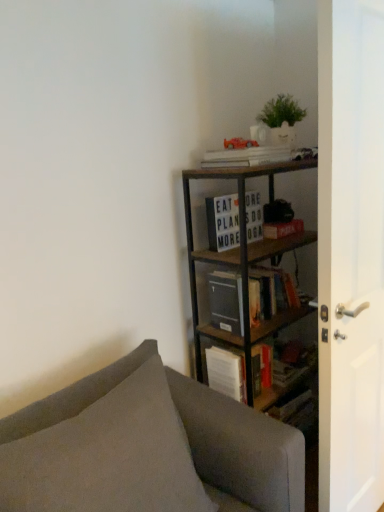
Question: Should I look upward or downward to see metallic brown bookcase at upper right?

Choices:
 (A) up
 (B) down

Answer: (B)

Question: Could you tell me if white glossy door at right is turned towards metallic brown bookcase at upper right?

Choices:
 (A) no
 (B) yes

Answer: (B)

Question: Are white glossy door at right and metallic brown bookcase at upper right far apart?

Choices:
 (A) no
 (B) yes

Answer: (A)

Question: From a real-world perspective, is white glossy door at right on top of metallic brown bookcase at upper right?

Choices:
 (A) yes
 (B) no

Answer: (A)

Question: From the image's perspective, is white glossy door at right below metallic brown bookcase at upper right?

Choices:
 (A) no
 (B) yes

Answer: (A)

Question: Can you confirm if white glossy door at right is positioned to the right of metallic brown bookcase at upper right?

Choices:
 (A) no
 (B) yes

Answer: (B)

Question: Considering the relative sizes of white glossy door at right and metallic brown bookcase at upper right in the image provided, is white glossy door at right wider than metallic brown bookcase at upper right?

Choices:
 (A) no
 (B) yes

Answer: (A)

Question: Does white matte paperback book at upper center have a greater height compared to metallic brown bookcase at upper right?

Choices:
 (A) yes
 (B) no

Answer: (B)

Question: From a real-world perspective, is white matte paperback book at upper center physically below metallic brown bookcase at upper right?

Choices:
 (A) yes
 (B) no

Answer: (B)

Question: Is white matte paperback book at upper center smaller than metallic brown bookcase at upper right?

Choices:
 (A) yes
 (B) no

Answer: (A)

Question: Does white matte paperback book at upper center have a larger size compared to metallic brown bookcase at upper right?

Choices:
 (A) yes
 (B) no

Answer: (B)

Question: Is the depth of white matte paperback book at upper center greater than that of metallic brown bookcase at upper right?

Choices:
 (A) no
 (B) yes

Answer: (B)

Question: Considering the relative sizes of white matte paperback book at upper center and metallic brown bookcase at upper right in the image provided, is white matte paperback book at upper center thinner than metallic brown bookcase at upper right?

Choices:
 (A) yes
 (B) no

Answer: (A)

Question: Considering the relative sizes of gray fabric couch at lower left and white matte paperback book at upper center in the image provided, is gray fabric couch at lower left wider than white matte paperback book at upper center?

Choices:
 (A) yes
 (B) no

Answer: (A)